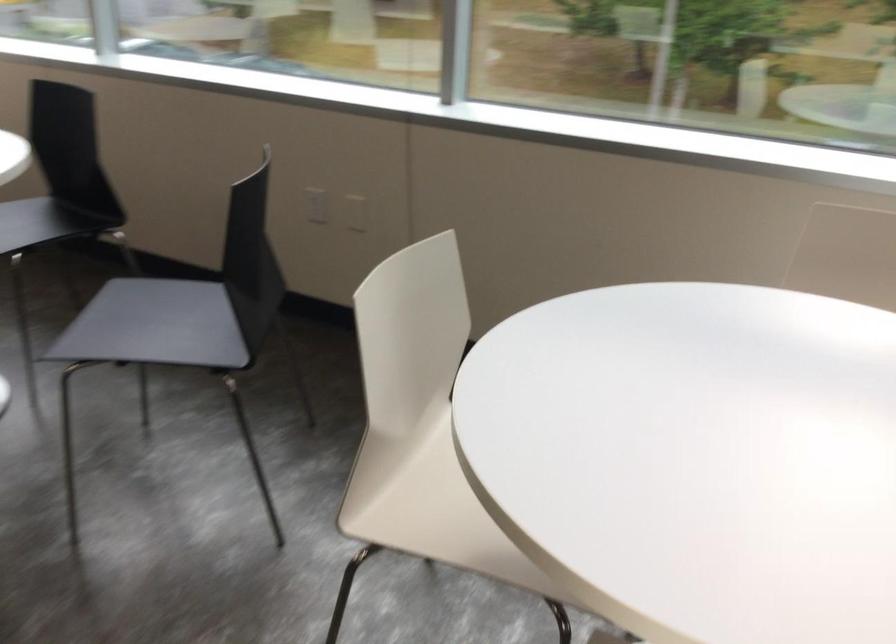
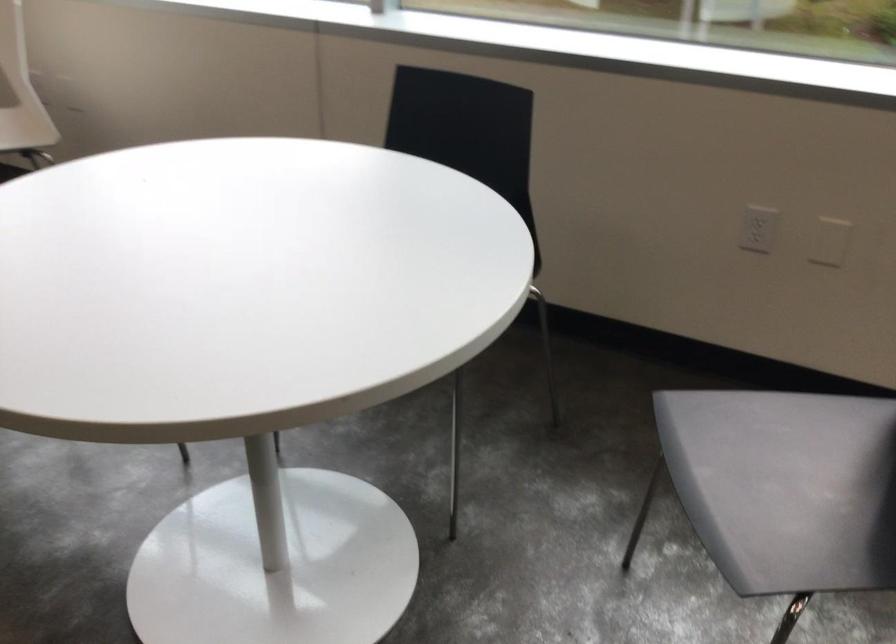
The images are taken continuously from a first-person perspective. In which direction are you moving?

The movement direction of the cameraman is left, forward.